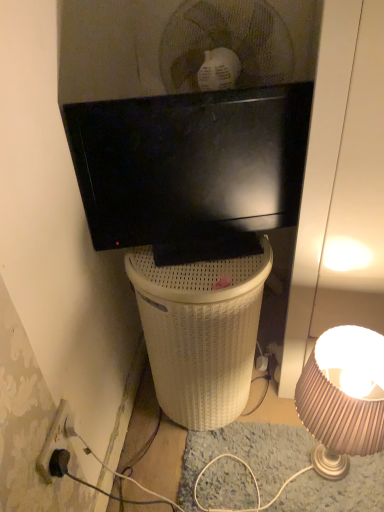
Question: Can you confirm if matte beige lampshade at lower right is taller than black plastic power outlet at lower left?

Choices:
 (A) yes
 (B) no

Answer: (A)

Question: Can you confirm if matte beige lampshade at lower right is smaller than black plastic power outlet at lower left?

Choices:
 (A) yes
 (B) no

Answer: (B)

Question: From the image's perspective, is matte beige lampshade at lower right on black plastic power outlet at lower left?

Choices:
 (A) yes
 (B) no

Answer: (B)

Question: Is the position of matte beige lampshade at lower right more distant than that of black plastic power outlet at lower left?

Choices:
 (A) yes
 (B) no

Answer: (A)

Question: Is matte beige lampshade at lower right to the left of black plastic power outlet at lower left from the viewer's perspective?

Choices:
 (A) no
 (B) yes

Answer: (A)

Question: From their relative heights in the image, would you say white wicker trash bin/can at center is taller or shorter than matte beige lampshade at lower right?

Choices:
 (A) short
 (B) tall

Answer: (B)

Question: From a real-world perspective, is white wicker trash bin/can at center physically located above or below matte beige lampshade at lower right?

Choices:
 (A) below
 (B) above

Answer: (B)

Question: Is white wicker trash bin/can at center spatially inside matte beige lampshade at lower right, or outside of it?

Choices:
 (A) outside
 (B) inside

Answer: (A)

Question: From the image's perspective, is white wicker trash bin/can at center above or below matte beige lampshade at lower right?

Choices:
 (A) above
 (B) below

Answer: (A)

Question: Would you say black plastic power outlet at lower left is inside or outside matte beige lampshade at lower right?

Choices:
 (A) outside
 (B) inside

Answer: (A)

Question: From the image's perspective, is black plastic power outlet at lower left located above or below matte beige lampshade at lower right?

Choices:
 (A) below
 (B) above

Answer: (B)

Question: From a real-world perspective, is black plastic power outlet at lower left physically located above or below matte beige lampshade at lower right?

Choices:
 (A) below
 (B) above

Answer: (B)

Question: Looking at the image, does black plastic power outlet at lower left seem bigger or smaller compared to matte beige lampshade at lower right?

Choices:
 (A) small
 (B) big

Answer: (A)

Question: Based on their sizes in the image, would you say black plastic power outlet at lower left is bigger or smaller than white wicker trash bin/can at center?

Choices:
 (A) small
 (B) big

Answer: (A)

Question: From the image's perspective, is black plastic power outlet at lower left above or below white wicker trash bin/can at center?

Choices:
 (A) below
 (B) above

Answer: (A)